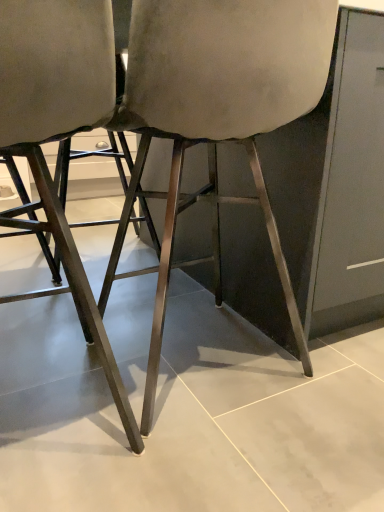
Question: Is satin silver chair at center, the 1th chair when ordered from right to left, taller or shorter than matte gray fabric chair at center, acting as the 2th chair starting from the right?

Choices:
 (A) short
 (B) tall

Answer: (B)

Question: Considering the relative positions of satin silver chair at center, the 1th chair when ordered from right to left, and matte gray fabric chair at center, which is the 1th chair from left to right, in the image provided, is satin silver chair at center, the 1th chair when ordered from right to left, to the left or to the right of matte gray fabric chair at center, which is the 1th chair from left to right,?

Choices:
 (A) left
 (B) right

Answer: (B)

Question: Looking at the image, does satin silver chair at center, which is the 2th chair from left to right, seem bigger or smaller compared to matte gray fabric chair at center, acting as the 2th chair starting from the right?

Choices:
 (A) big
 (B) small

Answer: (A)

Question: Which is correct: matte gray fabric chair at center, acting as the 2th chair starting from the right, is inside satin silver chair at center, which is the 2th chair from left to right, or outside of it?

Choices:
 (A) inside
 (B) outside

Answer: (B)

Question: In the image, is matte gray fabric chair at center, which is the 1th chair from left to right, on the left side or the right side of satin silver chair at center, which is the 2th chair from left to right?

Choices:
 (A) right
 (B) left

Answer: (B)

Question: From their relative heights in the image, would you say matte gray fabric chair at center, which is the 1th chair from left to right, is taller or shorter than satin silver chair at center, which is the 2th chair from left to right?

Choices:
 (A) short
 (B) tall

Answer: (A)

Question: Looking at the image, does matte gray fabric chair at center, which is the 1th chair from left to right, seem bigger or smaller compared to satin silver chair at center, the 1th chair when ordered from right to left?

Choices:
 (A) big
 (B) small

Answer: (B)